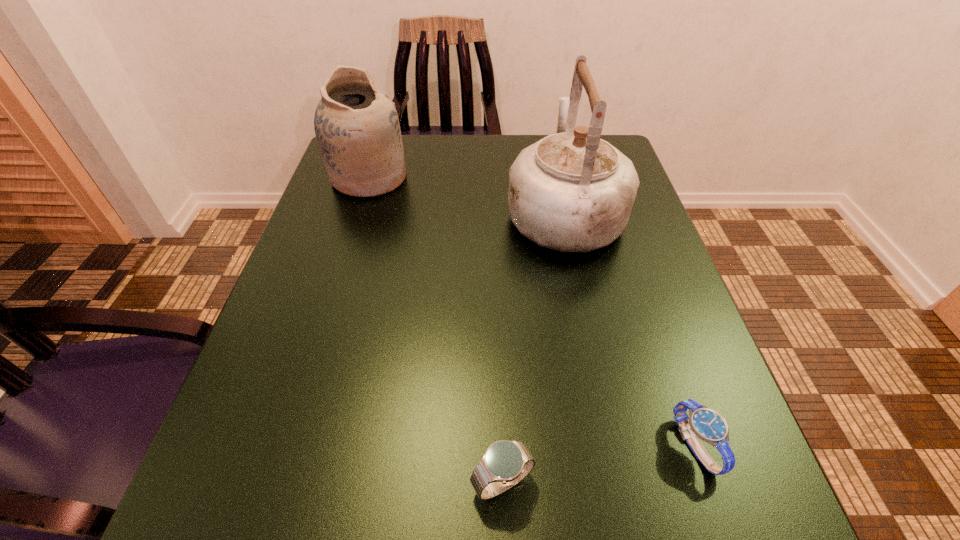
Where is `object at the far right corner`? This screenshot has width=960, height=540. object at the far right corner is located at coordinates (571, 191).

The width and height of the screenshot is (960, 540). In order to click on vacant space at the far edge in this screenshot , I will do `click(497, 176)`.

You are a GUI agent. You are given a task and a screenshot of the screen. Output one action in this format:
    pyautogui.click(x=<x>, y=<y>)
    Task: Click on the free region at the near edge of the desktop
    The height and width of the screenshot is (540, 960).
    Given the screenshot: What is the action you would take?
    pyautogui.click(x=420, y=494)

Where is `vacant area at the left edge of the desktop`? vacant area at the left edge of the desktop is located at coordinates (386, 231).

Find the location of a particular element. The width and height of the screenshot is (960, 540). vacant space at the right edge of the desktop is located at coordinates (696, 375).

Find the location of a particular element. The height and width of the screenshot is (540, 960). vacant space at the near left corner is located at coordinates (294, 532).

Identify the location of free area in between the shorter watch and the tallest object. The width and height of the screenshot is (960, 540). (629, 328).

The image size is (960, 540). What are the coordinates of `unoccupied position between the shorter watch and the tallest object` in the screenshot? It's located at (629, 328).

At what (x,y) coordinates should I click in order to perform the action: click on free space between the kettle and the taller watch. Please return your answer as a coordinate pair (x, y). The height and width of the screenshot is (540, 960). Looking at the image, I should click on (533, 347).

Identify the location of vacant space in between the left watch and the kettle. (533, 347).